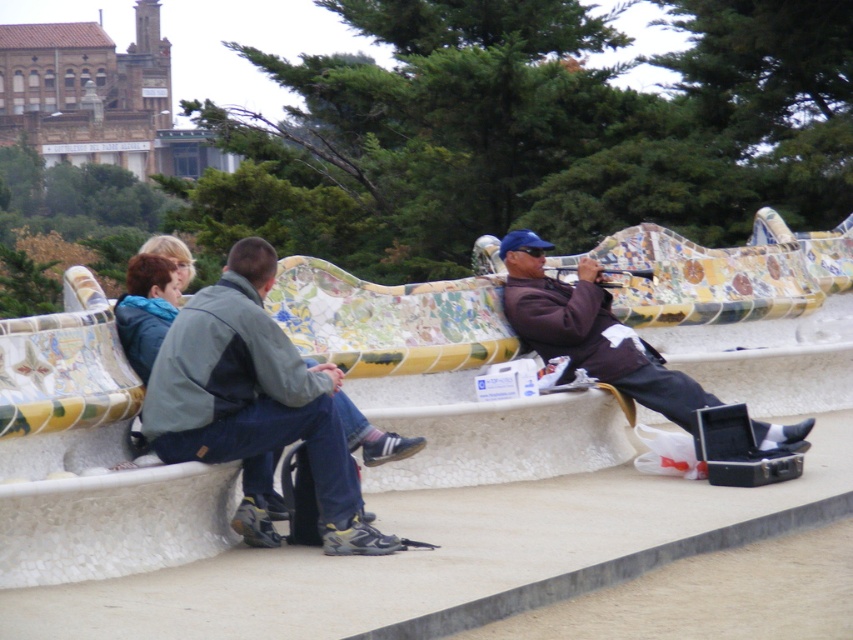
You are a photographer standing near the Gaud? bench and want to capture both the matte gray jacket at center and the matte brown jacket at center in a single shot. Given that your camera has a focal length of 50mm, which has a field of view wide enough to capture objects up to 10 feet apart, can you include both jackets in your photo?

The matte gray jacket at center is 8.38 feet from the matte brown jacket at center, which is within the 10 feet range of the camera with a 50mm focal length. Therefore, both jackets can be captured in a single shot.

You are standing in front of the Gaud? bench and notice two people sitting on it. One is wearing a matte gray jacket at center and the other a matte brown jacket at center. Which person is sitting to the left of the other?

The matte gray jacket at center is positioned on the left side of the matte brown jacket at center, so the person wearing the matte gray jacket at center is sitting to the left of the person in the matte brown jacket at center.